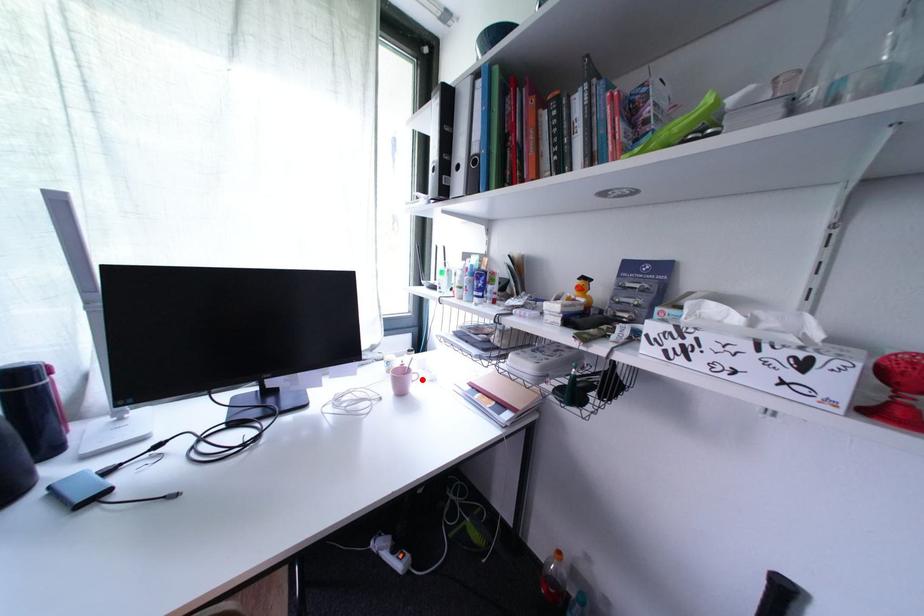
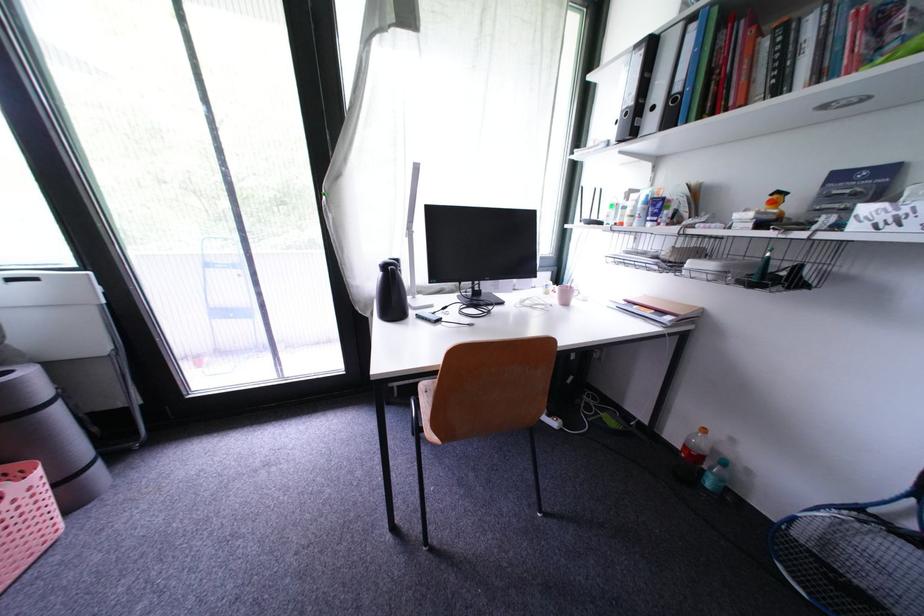
In the second image, find the point that corresponds to the highlighted location in the first image.

(584, 296)